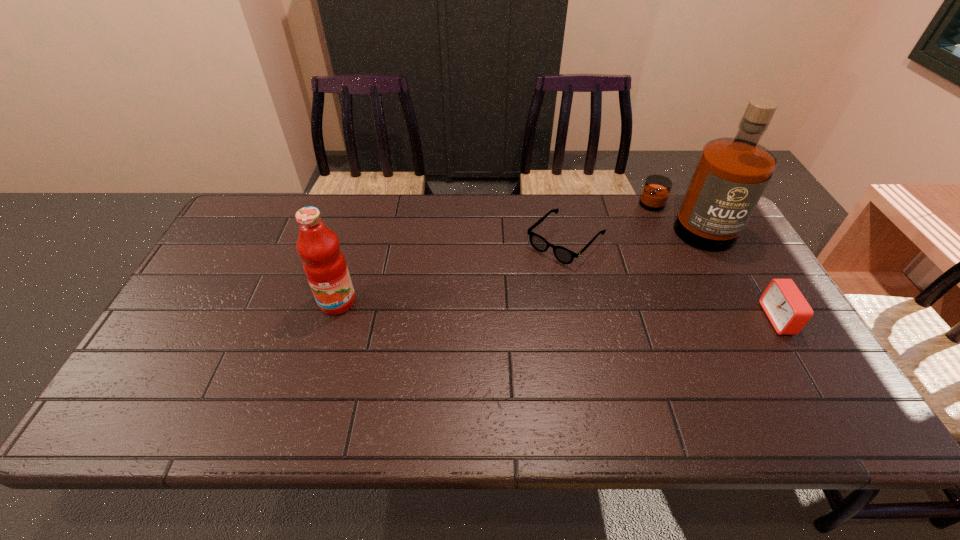
Where is `object located in the far right corner section of the desktop`? The width and height of the screenshot is (960, 540). object located in the far right corner section of the desktop is located at coordinates (732, 173).

The height and width of the screenshot is (540, 960). In order to click on vacant space at the far edge in this screenshot , I will do `click(553, 208)`.

Image resolution: width=960 pixels, height=540 pixels. Find the location of `vacant space at the near edge`. vacant space at the near edge is located at coordinates (645, 373).

At what (x,y) coordinates should I click in order to perform the action: click on vacant space at the left edge of the desktop. Please return your answer as a coordinate pair (x, y). The image size is (960, 540). Looking at the image, I should click on (224, 336).

Find the location of a particular element. The width and height of the screenshot is (960, 540). vacant space at the far left corner is located at coordinates (287, 203).

I want to click on unoccupied position between the liquor and the fruit juice, so click(x=513, y=262).

At what (x,y) coordinates should I click in order to perform the action: click on vacant space that is in between the alarm clock and the shortest object. Please return your answer as a coordinate pair (x, y). This screenshot has width=960, height=540. Looking at the image, I should click on (671, 280).

What are the coordinates of `empty space between the leftmost object and the spectacles` in the screenshot? It's located at (451, 272).

Find the location of a particular element. This screenshot has height=540, width=960. empty location between the shortest object and the alarm clock is located at coordinates (671, 280).

This screenshot has height=540, width=960. I want to click on blank region between the alarm clock and the third object from right to left, so click(671, 280).